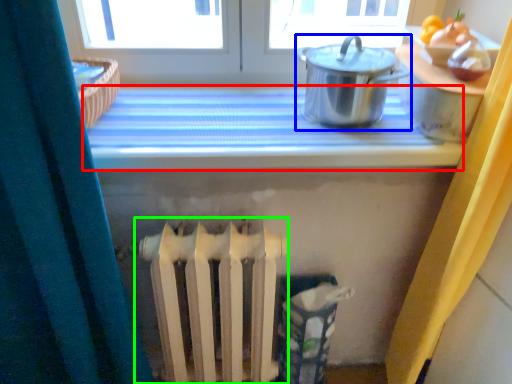
Question: Which object is positioned farthest from counter top (highlighted by a red box)? Select from kitchen appliance (highlighted by a blue box) and radiator (highlighted by a green box).

Choices:
 (A) kitchen appliance
 (B) radiator

Answer: (B)